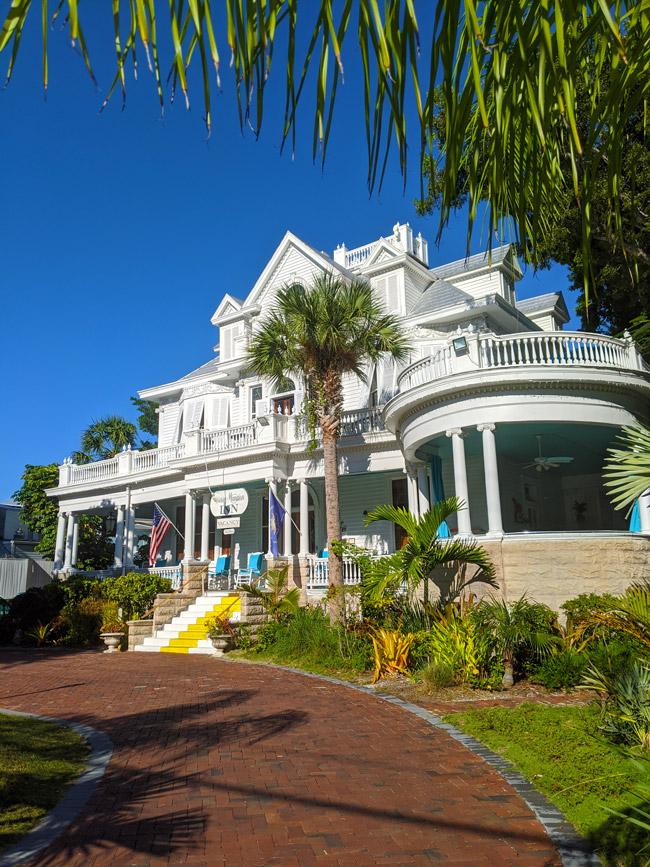
Locate an element on the screen. Image resolution: width=650 pixels, height=867 pixels. planter on right side of steps is located at coordinates (221, 641).